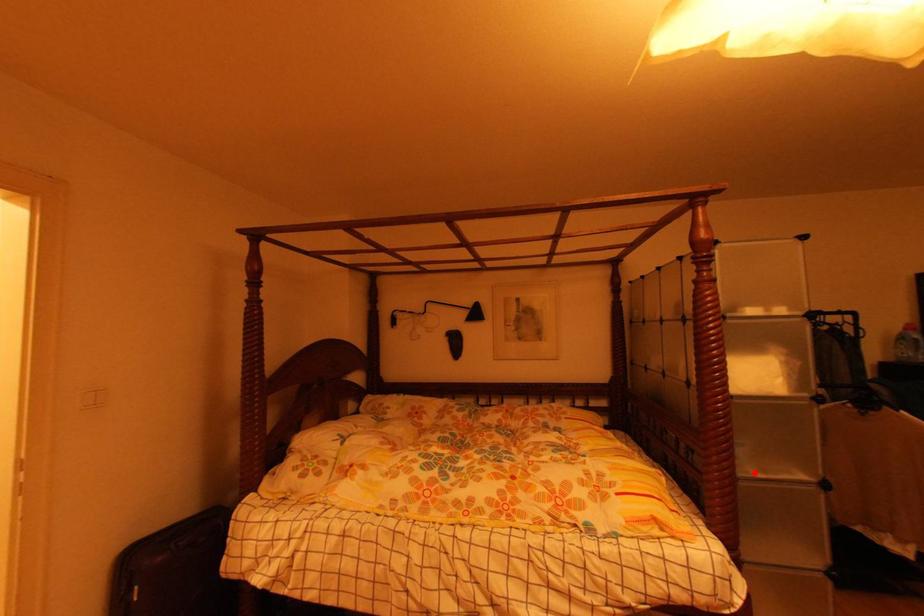
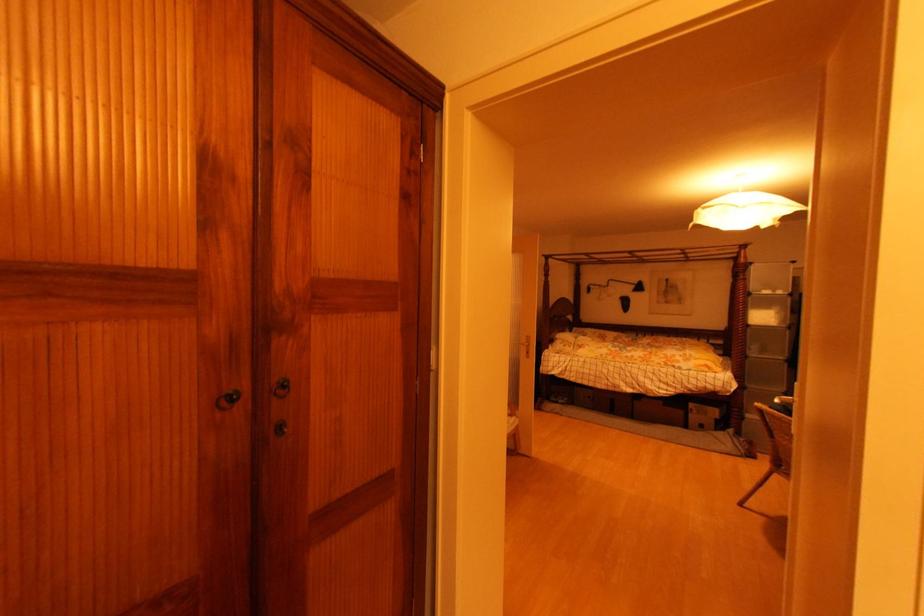
Find the pixel in the second image that matches the highlighted location in the first image.

(759, 355)